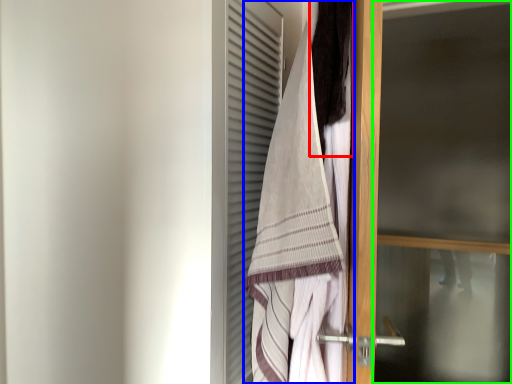
Question: Which object is positioned farthest from hair (highlighted by a red box)? Select from towel (highlighted by a blue box) and screen door (highlighted by a green box).

Choices:
 (A) towel
 (B) screen door

Answer: (B)